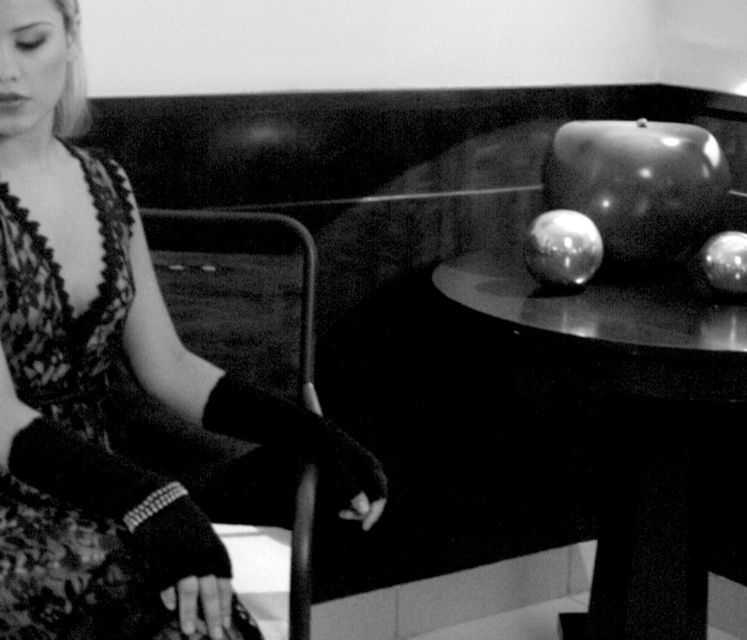
Question: Estimate the real-world distances between objects in this image. Which object is closer to the glossy metallic apple at upper right?

Choices:
 (A) glossy metallic apple at center
 (B) glossy metallic apple at right
 (C) glossy metallic table at upper right

Answer: (A)

Question: Is the position of lace fabric dress at left less distant than that of glossy metallic apple at right?

Choices:
 (A) no
 (B) yes

Answer: (B)

Question: Can you confirm if glossy metallic table at upper right is positioned below lace fabric dress at left?

Choices:
 (A) yes
 (B) no

Answer: (A)

Question: Where is glossy metallic table at upper right located in relation to glossy metallic apple at upper right in the image?

Choices:
 (A) below
 (B) above

Answer: (A)

Question: Which of the following is the farthest from the observer?

Choices:
 (A) glossy metallic apple at upper right
 (B) glossy metallic apple at center

Answer: (A)

Question: Estimate the real-world distances between objects in this image. Which object is closer to the glossy metallic apple at upper right?

Choices:
 (A) glossy metallic table at upper right
 (B) glossy metallic apple at right
 (C) lace fabric dress at left
 (D) glossy metallic apple at center

Answer: (D)